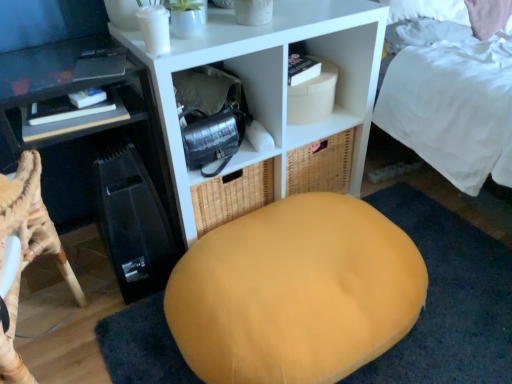
What do you see at coordinates (273, 79) in the screenshot? This screenshot has width=512, height=384. I see `white matte shelf at center, which is counted as the 2th shelf, starting from the left` at bounding box center [273, 79].

Measure the distance between point (159, 290) and camera.

They are 4.42 feet apart.

Where is `white matte shelf at center, which is counted as the 2th shelf, starting from the left`? The image size is (512, 384). white matte shelf at center, which is counted as the 2th shelf, starting from the left is located at coordinates (273, 79).

Which of these two, matte black desk at left or velvet yellow bean bag at center, stands shorter?

velvet yellow bean bag at center is shorter.

From a real-world perspective, is matte black desk at left physically below velvet yellow bean bag at center?

No, from a real-world perspective, matte black desk at left is not below velvet yellow bean bag at center.

Could you tell me if matte black desk at left is facing velvet yellow bean bag at center?

No, matte black desk at left does not turn towards velvet yellow bean bag at center.

Does velvet yellow bean bag at center turn towards white matte shelf at center, which is counted as the 2th shelf, starting from the left?

No, velvet yellow bean bag at center is not turned towards white matte shelf at center, which is counted as the 2th shelf, starting from the left.

Does velvet yellow bean bag at center have a smaller size compared to white matte shelf at center, the first shelf from the right?

Indeed, velvet yellow bean bag at center has a smaller size compared to white matte shelf at center, the first shelf from the right.

Is velvet yellow bean bag at center completely or partially outside of white matte shelf at center, which is counted as the 2th shelf, starting from the left?

Absolutely, velvet yellow bean bag at center is external to white matte shelf at center, which is counted as the 2th shelf, starting from the left.

Which of these two, velvet yellow bean bag at center or white matte shelf at center, the first shelf from the right, is thinner?

white matte shelf at center, the first shelf from the right, is thinner.

Does velvet yellow bean bag at center have a smaller size compared to black plastic shelf at left, the first shelf in the left-to-right sequence?

No, velvet yellow bean bag at center is not smaller than black plastic shelf at left, the first shelf in the left-to-right sequence.

Which of these two, velvet yellow bean bag at center or black plastic shelf at left, the first shelf in the left-to-right sequence, is thinner?

black plastic shelf at left, the first shelf in the left-to-right sequence.

Considering the positions of objects velvet yellow bean bag at center and black plastic shelf at left, marked as the 2th shelf in a right-to-left arrangement, in the image provided, who is in front, velvet yellow bean bag at center or black plastic shelf at left, marked as the 2th shelf in a right-to-left arrangement,?

Positioned in front is velvet yellow bean bag at center.

Which object is positioned more to the right, velvet yellow bean bag at center or black plastic shelf at left, the first shelf in the left-to-right sequence?

From the viewer's perspective, velvet yellow bean bag at center appears more on the right side.

From a real-world perspective, is velvet yellow bean bag at center positioned over matte black desk at left based on gravity?

Actually, velvet yellow bean bag at center is physically below matte black desk at left in the real world.

Is point (419, 308) positioned behind point (13, 292)?

Yes, it is behind point (13, 292).

Can you confirm if velvet yellow bean bag at center is positioned to the right of matte black desk at left?

Indeed, velvet yellow bean bag at center is positioned on the right side of matte black desk at left.

From the image's perspective, is velvet yellow bean bag at center over matte black desk at left?

Incorrect, from the image's perspective, velvet yellow bean bag at center is lower than matte black desk at left.

Which is more to the left, white matte shelf at center, the first shelf from the right, or black plastic shelf at left, the first shelf in the left-to-right sequence?

black plastic shelf at left, the first shelf in the left-to-right sequence, is more to the left.

Consider the image. From a real-world perspective, is white matte shelf at center, the first shelf from the right, above or below black plastic shelf at left, the first shelf in the left-to-right sequence?

white matte shelf at center, the first shelf from the right, is situated higher than black plastic shelf at left, the first shelf in the left-to-right sequence, in the real world.

Is point (378, 31) farther from viewer compared to point (143, 97)?

Yes, point (378, 31) is farther from viewer.

Considering the positions of objects white matte shelf at center, which is counted as the 2th shelf, starting from the left, and black plastic shelf at left, the first shelf in the left-to-right sequence, in the image provided, who is in front, white matte shelf at center, which is counted as the 2th shelf, starting from the left, or black plastic shelf at left, the first shelf in the left-to-right sequence,?

Positioned in front is white matte shelf at center, which is counted as the 2th shelf, starting from the left.

Who is bigger, white matte shelf at center, which is counted as the 2th shelf, starting from the left, or matte black desk at left?

Bigger between the two is white matte shelf at center, which is counted as the 2th shelf, starting from the left.

Is white matte shelf at center, the first shelf from the right, far away from matte black desk at left?

Actually, white matte shelf at center, the first shelf from the right, and matte black desk at left are a little close together.

Is white matte shelf at center, the first shelf from the right, facing away from matte black desk at left?

white matte shelf at center, the first shelf from the right, does not have its back to matte black desk at left.

Between white matte shelf at center, the first shelf from the right, and matte black desk at left, which one appears on the right side from the viewer's perspective?

From the viewer's perspective, white matte shelf at center, the first shelf from the right, appears more on the right side.

How different are the orientations of white matte shelf at center, the first shelf from the right, and velvet yellow bean bag at center in degrees?

The facing directions of white matte shelf at center, the first shelf from the right, and velvet yellow bean bag at center are 89.9 degrees apart.

Do you think white matte shelf at center, the first shelf from the right, is within velvet yellow bean bag at center, or outside of it?

white matte shelf at center, the first shelf from the right, lies outside velvet yellow bean bag at center.

Which is less distant, (286, 51) or (345, 248)?

The point (345, 248) is more forward.

Does white matte shelf at center, which is counted as the 2th shelf, starting from the left, come in front of velvet yellow bean bag at center?

No, white matte shelf at center, which is counted as the 2th shelf, starting from the left, is further to the viewer.

Locate an element on the screen. furniture that appears in front of the velvet yellow bean bag at center is located at coordinates (27, 252).

You are a GUI agent. You are given a task and a screenshot of the screen. Output one action in this format:
    pyautogui.click(x=<x>, y=<y>)
    Task: Click on the shelf that is the 2nd one above the velvet yellow bean bag at center (from a real-world perspective)
    The width and height of the screenshot is (512, 384).
    Given the screenshot: What is the action you would take?
    pyautogui.click(x=273, y=79)

Which object lies nearer to the anchor point black plastic shelf at left, marked as the 2th shelf in a right-to-left arrangement, velvet yellow bean bag at center or white matte shelf at center, which is counted as the 2th shelf, starting from the left?

The object closer to black plastic shelf at left, marked as the 2th shelf in a right-to-left arrangement, is white matte shelf at center, which is counted as the 2th shelf, starting from the left.

From the image, which object appears to be nearer to black plastic shelf at left, the first shelf in the left-to-right sequence, white matte shelf at center, the first shelf from the right, or matte black desk at left?

matte black desk at left.

Estimate the real-world distances between objects in this image. Which object is further from black plastic shelf at left, marked as the 2th shelf in a right-to-left arrangement, matte black desk at left or white matte shelf at center, the first shelf from the right?

Based on the image, white matte shelf at center, the first shelf from the right, appears to be further to black plastic shelf at left, marked as the 2th shelf in a right-to-left arrangement.

When comparing their distances from black plastic shelf at left, the first shelf in the left-to-right sequence, does white matte shelf at center, which is counted as the 2th shelf, starting from the left, or velvet yellow bean bag at center seem further?

velvet yellow bean bag at center is positioned further to the anchor black plastic shelf at left, the first shelf in the left-to-right sequence.

Which object lies nearer to the anchor point matte black desk at left, black plastic shelf at left, the first shelf in the left-to-right sequence, or velvet yellow bean bag at center?

black plastic shelf at left, the first shelf in the left-to-right sequence.

Considering their positions, is black plastic shelf at left, marked as the 2th shelf in a right-to-left arrangement, positioned closer to velvet yellow bean bag at center than white matte shelf at center, the first shelf from the right?

white matte shelf at center, the first shelf from the right.

Which object lies nearer to the anchor point white matte shelf at center, the first shelf from the right, velvet yellow bean bag at center or matte black desk at left?

velvet yellow bean bag at center lies closer to white matte shelf at center, the first shelf from the right, than the other object.

Looking at the image, which one is located closer to white matte shelf at center, which is counted as the 2th shelf, starting from the left, velvet yellow bean bag at center or black plastic shelf at left, the first shelf in the left-to-right sequence?

black plastic shelf at left, the first shelf in the left-to-right sequence.

Image resolution: width=512 pixels, height=384 pixels. I want to click on shelf between black plastic shelf at left, the first shelf in the left-to-right sequence, and velvet yellow bean bag at center from left to right, so click(273, 79).

Find the location of a particular element. shelf between matte black desk at left and black plastic shelf at left, the first shelf in the left-to-right sequence, along the z-axis is located at coordinates (273, 79).